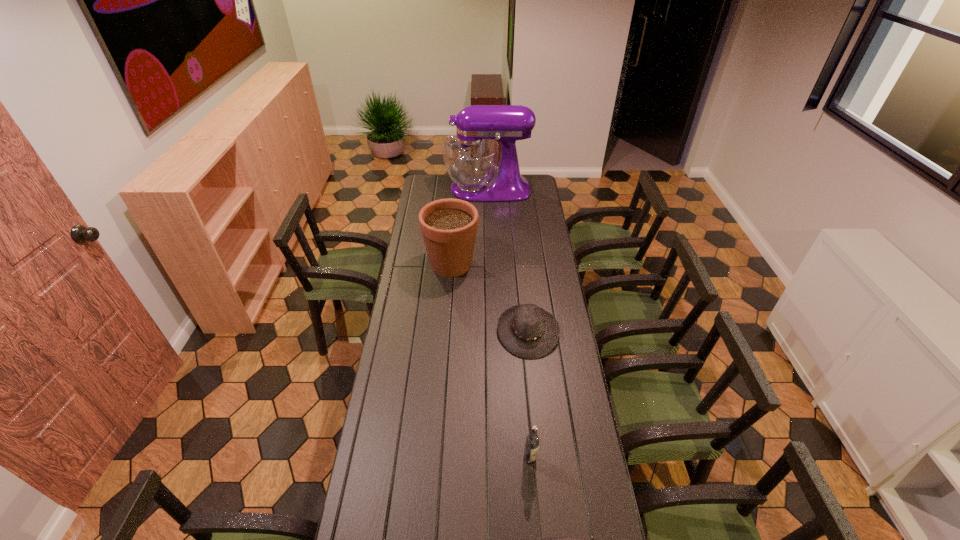
Where is `the farthest object`? The width and height of the screenshot is (960, 540). the farthest object is located at coordinates (470, 157).

You are a GUI agent. You are given a task and a screenshot of the screen. Output one action in this format:
    pyautogui.click(x=<x>, y=<y>)
    Task: Click on the mixer
    
    Given the screenshot: What is the action you would take?
    pyautogui.click(x=470, y=157)

Image resolution: width=960 pixels, height=540 pixels. In order to click on the second farthest object in this screenshot , I will do `click(449, 226)`.

This screenshot has width=960, height=540. What are the coordinates of `flowerpot` in the screenshot? It's located at (449, 226).

I want to click on the third shortest object, so click(x=532, y=440).

Find the location of `vodka`. vodka is located at coordinates (532, 440).

Identify the location of the fourth tallest object. (527, 331).

The width and height of the screenshot is (960, 540). In order to click on the taller hat in this screenshot , I will do `click(527, 331)`.

Identify the location of vacant area situated 0.150m at the bowl opening of the tallest object. (420, 189).

Where is `vacant area situated on the back of the fourth nearest object`? Image resolution: width=960 pixels, height=540 pixels. vacant area situated on the back of the fourth nearest object is located at coordinates click(x=453, y=232).